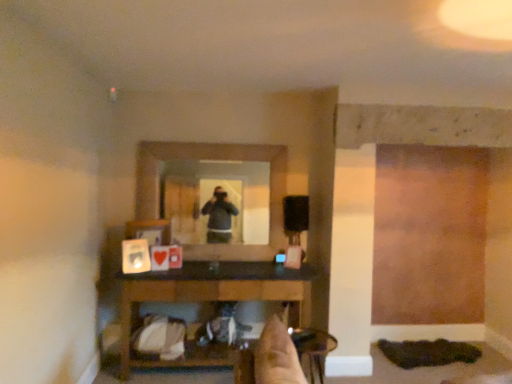
Question: Is clear glass mirror at center inside or outside of wooden table at lower center?

Choices:
 (A) outside
 (B) inside

Answer: (A)

Question: From the image's perspective, is clear glass mirror at center positioned above or below wooden table at lower center?

Choices:
 (A) above
 (B) below

Answer: (A)

Question: Which object is the closest to the clear glass mirror at center?

Choices:
 (A) wooden table at lower center
 (B) metallic silver chair at lower center

Answer: (A)

Question: Which object is the farthest from the metallic silver chair at lower center?

Choices:
 (A) wooden table at lower center
 (B) clear glass mirror at center

Answer: (B)